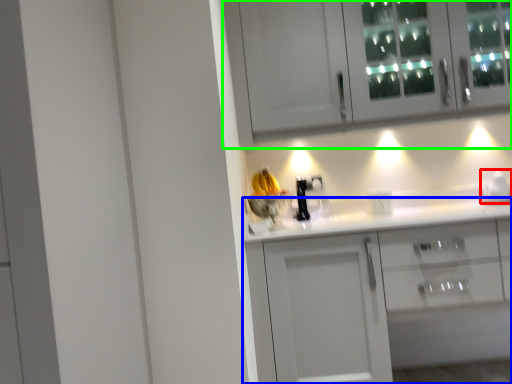
Question: Considering the real-world distances, which object is closest to appliance (highlighted by a red box)? cabinetry (highlighted by a blue box) or cabinetry (highlighted by a green box).

Choices:
 (A) cabinetry
 (B) cabinetry

Answer: (A)